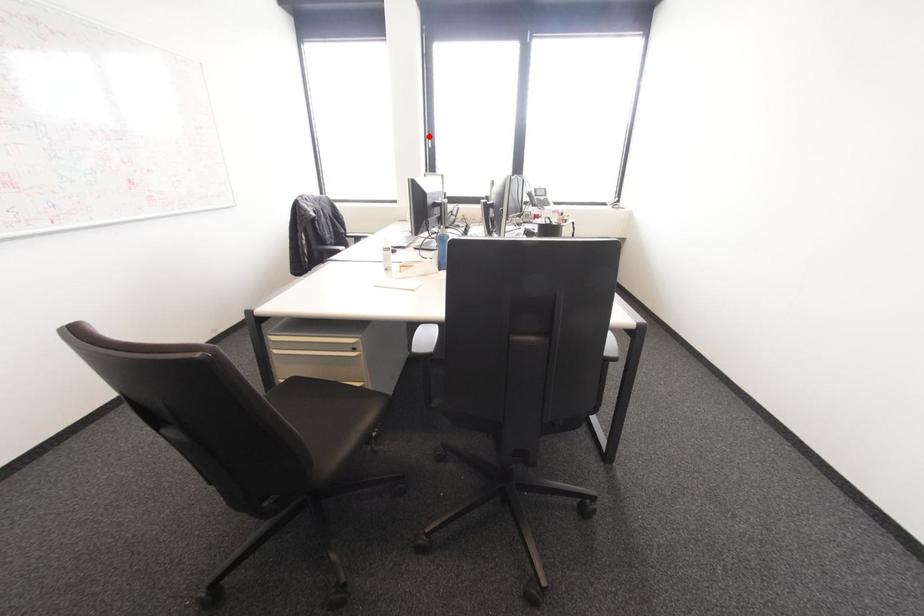
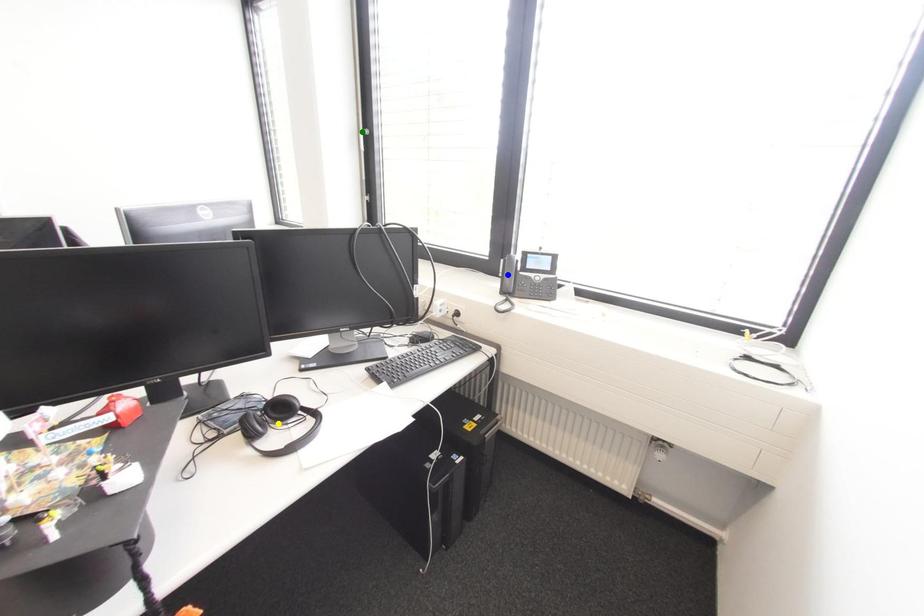
Question: I am providing you with two images of the same scene from different viewpoints. A red point is marked on the first image. You are given multiple points on the second image. Can you choose the point in image 2 that corresponds to the point in image 1?

Choices:
 (A) green point
 (B) yellow point
 (C) blue point

Answer: (A)